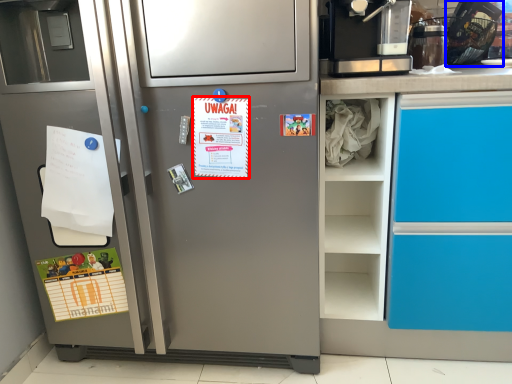
Question: Which of the following is the closest to the observer, postcard (highlighted by a red box) or appliance (highlighted by a blue box)?

Choices:
 (A) postcard
 (B) appliance

Answer: (A)